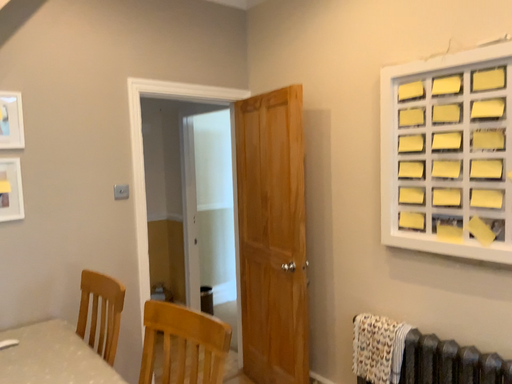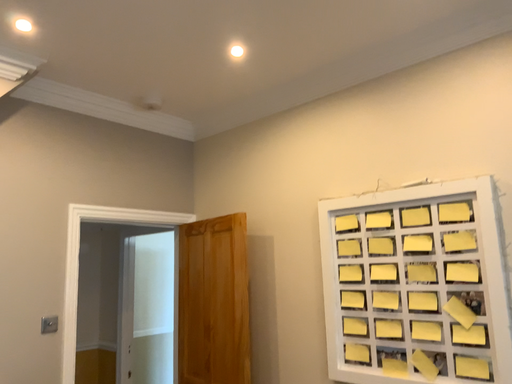
Question: How did the camera likely rotate when shooting the video?

Choices:
 (A) rotated left
 (B) rotated right

Answer: (B)